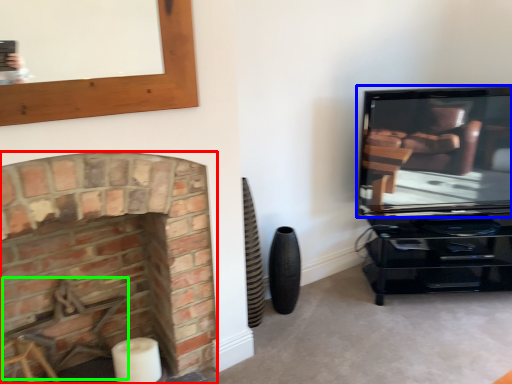
Question: Which is nearer to the fireplace (highlighted by a red box)? television (highlighted by a blue box) or swivel chair (highlighted by a green box).

Choices:
 (A) television
 (B) swivel chair

Answer: (B)